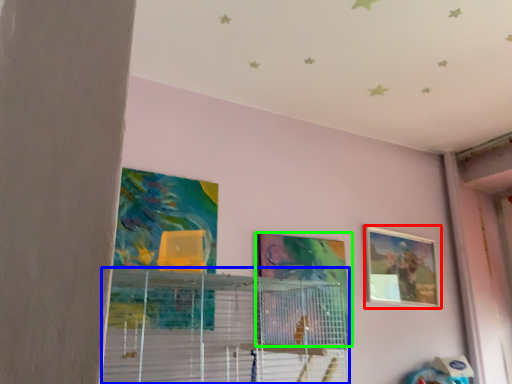
Question: Which is farther away from picture frame (highlighted by a red box)? shelf (highlighted by a blue box) or picture frame (highlighted by a green box)?

Choices:
 (A) shelf
 (B) picture frame

Answer: (A)